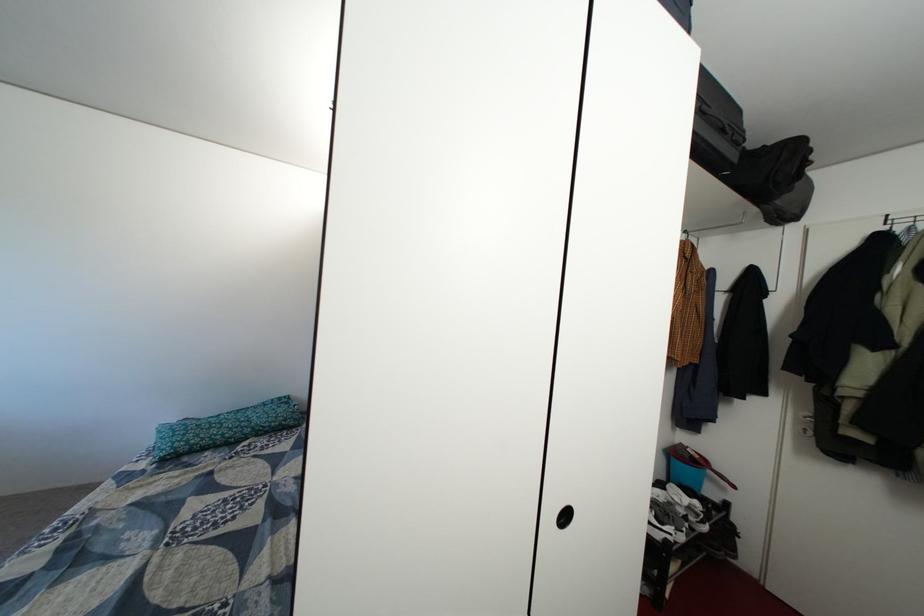
Where is `red dustpan handle`? The image size is (924, 616). red dustpan handle is located at coordinates (721, 479).